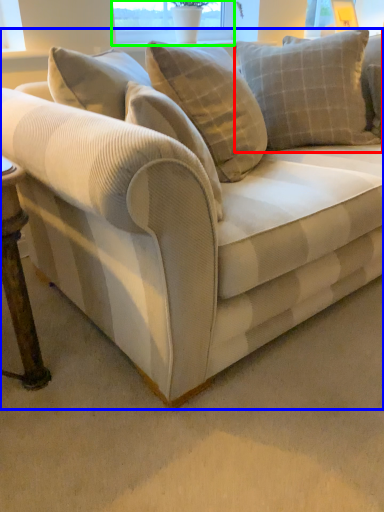
Question: Considering the real-world distances, which object is farthest from pillow (highlighted by a red box)? studio couch (highlighted by a blue box) or window screen (highlighted by a green box)?

Choices:
 (A) studio couch
 (B) window screen

Answer: (B)